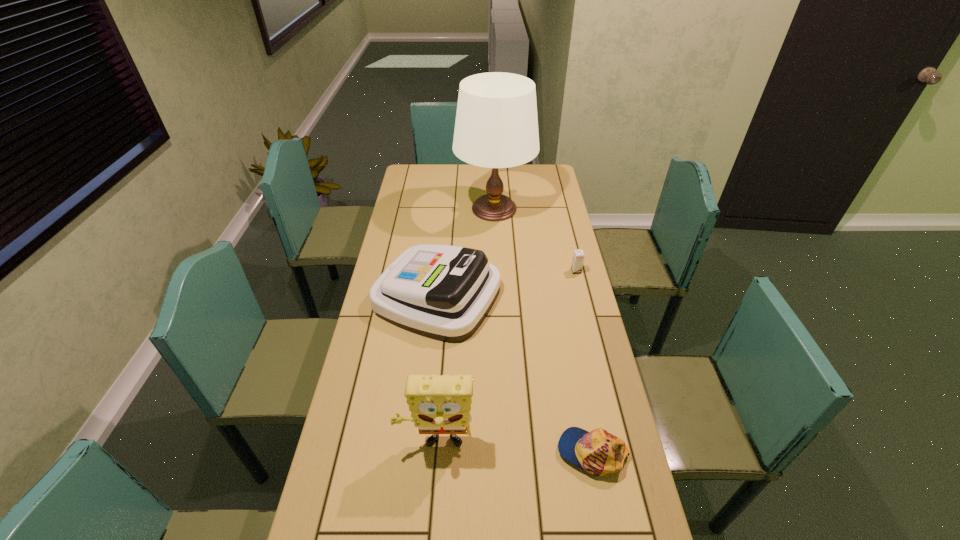
You are a GUI agent. You are given a task and a screenshot of the screen. Output one action in this format:
    pyautogui.click(x=<x>, y=<y>)
    Task: Click on the free space at the far left corner of the desktop
    The width and height of the screenshot is (960, 540).
    Given the screenshot: What is the action you would take?
    pyautogui.click(x=410, y=164)

Locate an element on the screen. The height and width of the screenshot is (540, 960). vacant region at the far right corner of the desktop is located at coordinates (536, 167).

The image size is (960, 540). What are the coordinates of `vacant area that lies between the cap and the chocolate milk` in the screenshot? It's located at (584, 362).

I want to click on vacant space that's between the shortest object and the second tallest object, so click(x=514, y=448).

Identify the location of vacant space in between the chocolate milk and the fourth shortest object. (506, 358).

In order to click on vacant area that lies between the second tallest object and the second shortest object in this screenshot , I will do `click(506, 358)`.

Identify the location of empty space between the farthest object and the cap. The width and height of the screenshot is (960, 540). (543, 330).

Identify the location of free space that is in between the second tallest object and the cap. This screenshot has height=540, width=960. (514, 448).

The image size is (960, 540). I want to click on the second closest object to the fourth tallest object, so click(442, 292).

Identify which object is the third closest to the cap. Please provide its 2D coordinates. Your answer should be formatted as a tuple, i.e. [(x, y)], where the tuple contains the x and y coordinates of a point satisfying the conditions above.

[(578, 256)]